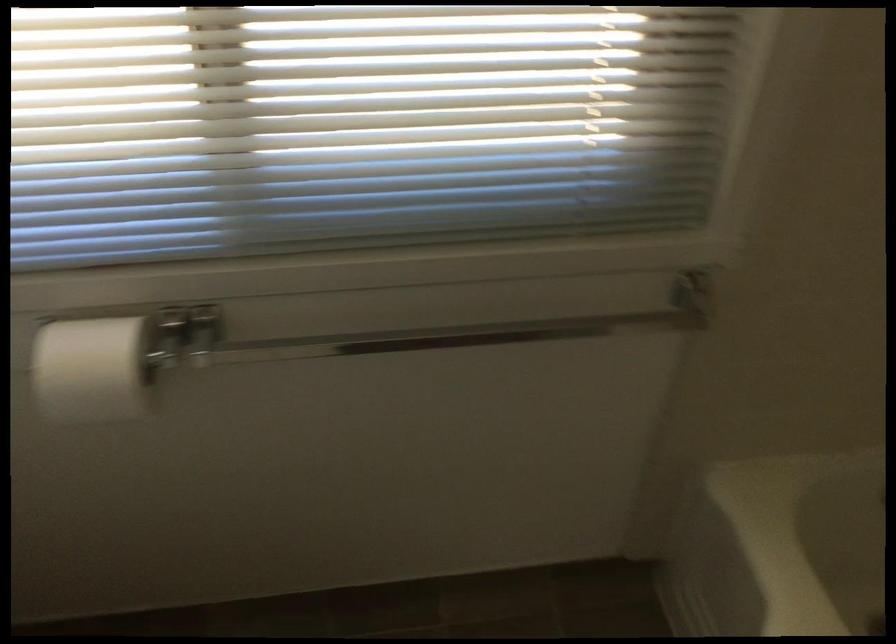
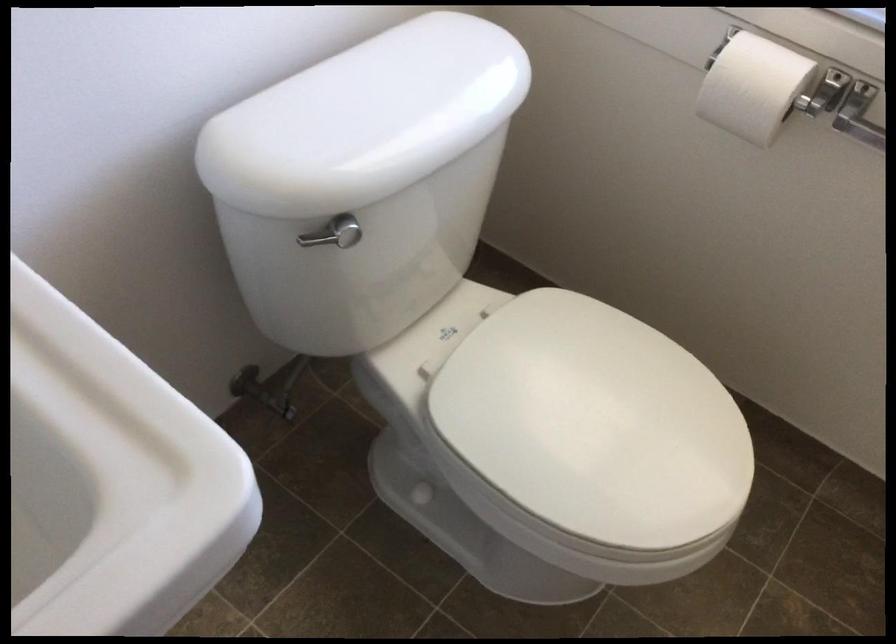
Where in the second image is the point corresponding to (90,381) from the first image?

(753, 87)